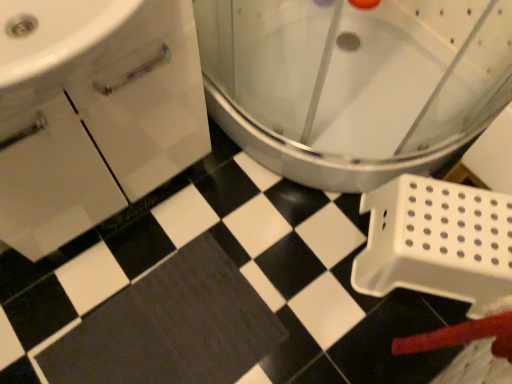
Identify the location of unoccupied region to the right of black matte bath mat at center. Image resolution: width=512 pixels, height=384 pixels. (317, 306).